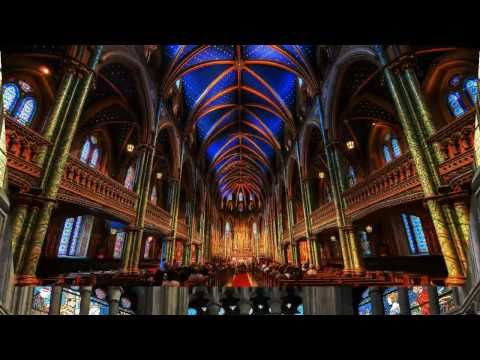
The width and height of the screenshot is (480, 360). Identify the location of hanging light. (350, 145), (321, 175), (158, 174), (131, 147), (42, 70), (368, 231), (333, 236), (112, 232), (151, 238).